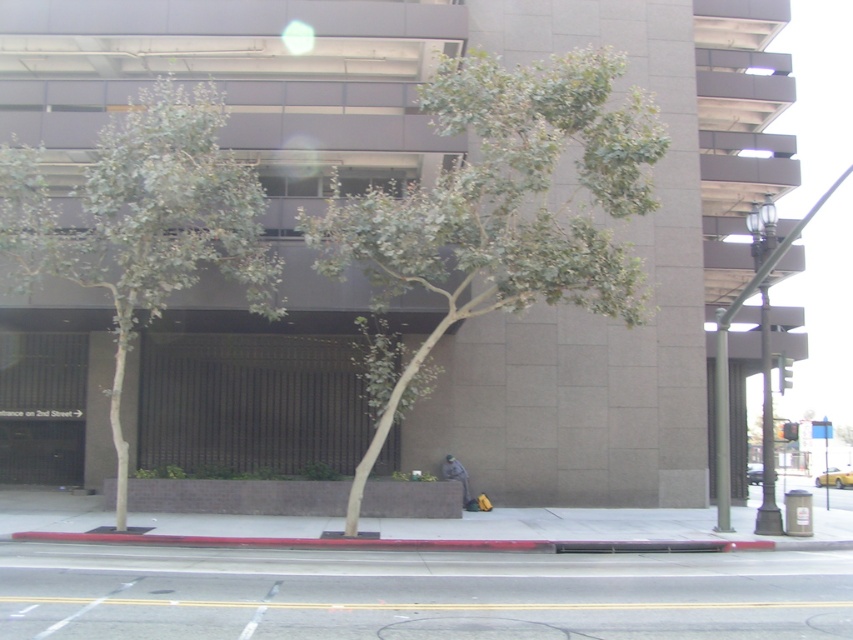
Question: Which is farther from the red rubber curb at lower center?

Choices:
 (A) gray asphalt at lower center
 (B) green leafy tree at center
 (C) green leafy tree at left

Answer: (B)

Question: Can you confirm if green leafy tree at center is wider than green leafy tree at left?

Choices:
 (A) no
 (B) yes

Answer: (A)

Question: Is gray asphalt at lower center positioned at the back of green leafy tree at left?

Choices:
 (A) yes
 (B) no

Answer: (B)

Question: Which object is closer to the camera taking this photo?

Choices:
 (A) gray asphalt at lower center
 (B) green leafy tree at left
 (C) red rubber curb at lower center

Answer: (A)

Question: Estimate the real-world distances between objects in this image. Which object is farther from the gray asphalt at lower center?

Choices:
 (A) green leafy tree at center
 (B) green leafy tree at left
 (C) red rubber curb at lower center

Answer: (A)

Question: Is green leafy tree at center wider than red rubber curb at lower center?

Choices:
 (A) yes
 (B) no

Answer: (B)